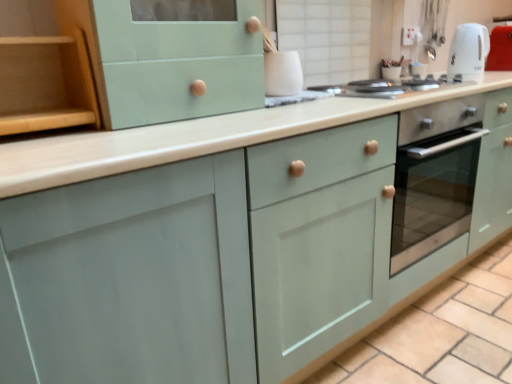
Question: Is point (370, 96) positioned closer to the camera than point (498, 59)?

Choices:
 (A) closer
 (B) farther

Answer: (A)

Question: From a real-world perspective, is white glossy stovetop at upper center physically located above or below white glossy kettle at upper right, the 2th appliance in the bottom-to-top sequence?

Choices:
 (A) below
 (B) above

Answer: (A)

Question: Estimate the real-world distances between objects in this image. Which object is farther from the white glossy electric kettle at upper right?

Choices:
 (A) wooden shelf at left
 (B) white glossy kettle at upper center, the first appliance in the left-to-right sequence
 (C) white glossy kettle at upper right, arranged as the 2th appliance when viewed from the front
 (D) white glossy stovetop at upper center
 (E) matte green cabinet at center

Answer: (A)

Question: Which is farther from the white glossy kettle at upper center, the first appliance from the bottom?

Choices:
 (A) wooden shelf at left
 (B) matte green cabinet at center
 (C) white glossy kettle at upper right, arranged as the 2th appliance when viewed from the front
 (D) white glossy electric kettle at upper right
 (E) white glossy stovetop at upper center

Answer: (C)